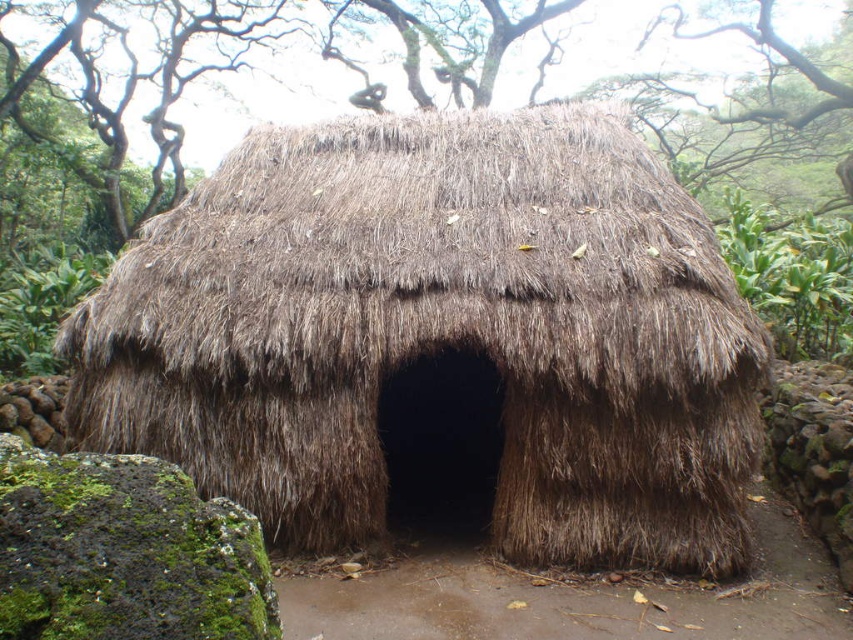
Question: Can you confirm if brown thatch hut at center is positioned below green leafy plant at upper right?

Choices:
 (A) yes
 (B) no

Answer: (A)

Question: Is brown thatch hut at center closer to camera compared to green leafy plant at upper right?

Choices:
 (A) no
 (B) yes

Answer: (B)

Question: Can you confirm if brown thatch hut at center is bigger than green leafy plant at upper right?

Choices:
 (A) no
 (B) yes

Answer: (A)

Question: Which of the following is the farthest from the observer?

Choices:
 (A) green leafy plant at upper right
 (B) brown thatch hut at center

Answer: (A)

Question: Among these points, which one is nearest to the camera?

Choices:
 (A) (756, 212)
 (B) (670, 556)

Answer: (B)